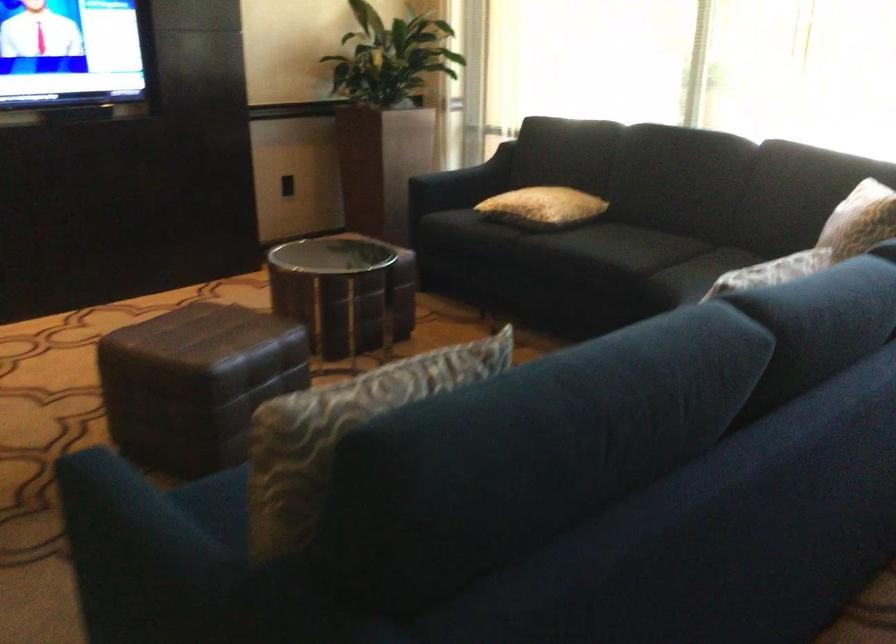
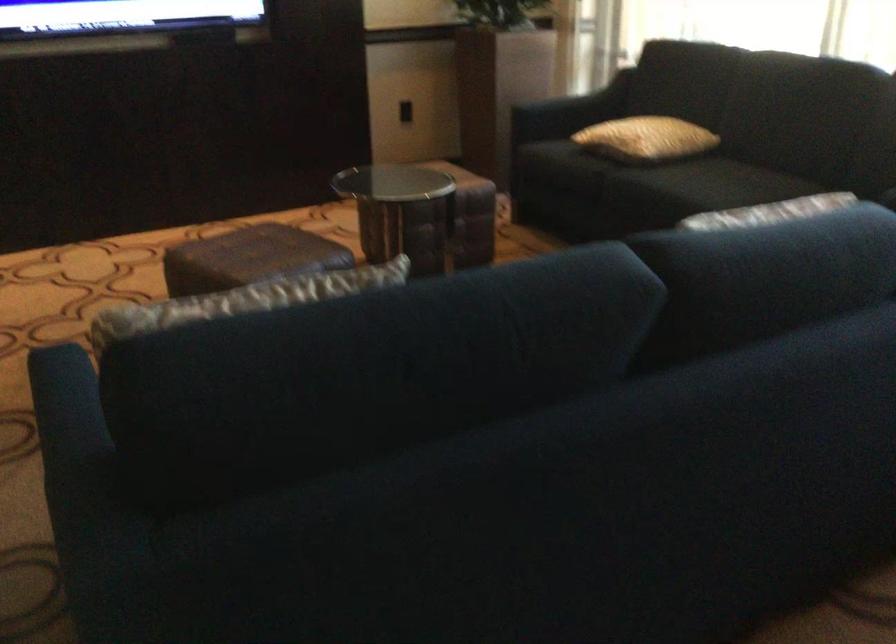
In the second image, find the point that corresponds to point 475,172 in the first image.

(586, 99)